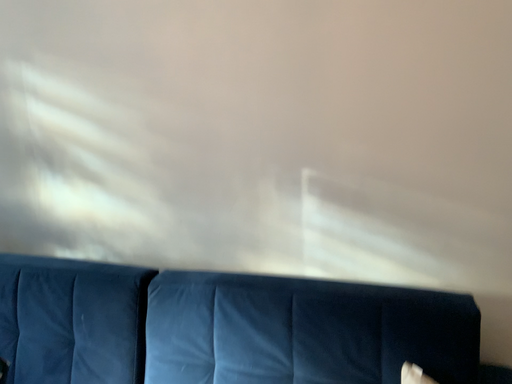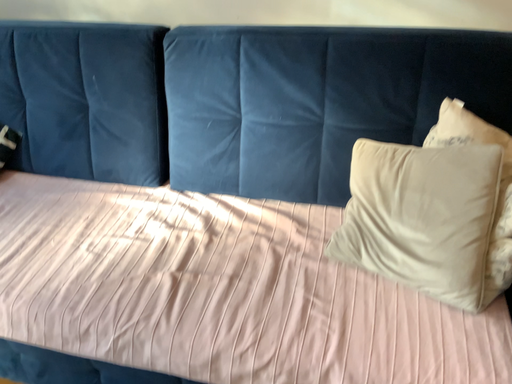
Question: Which way did the camera rotate in the video?

Choices:
 (A) rotated downward
 (B) rotated upward

Answer: (A)